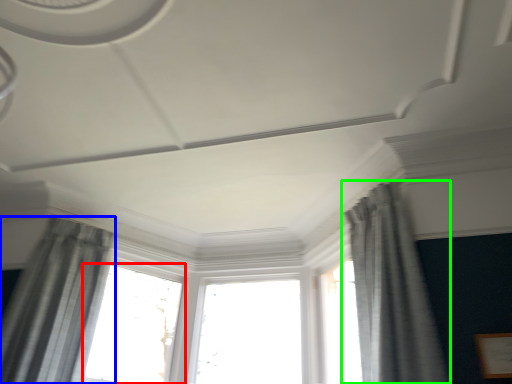
Question: Based on their relative distances, which object is nearer to window (highlighted by a red box)? Choose from curtain (highlighted by a blue box) and curtain (highlighted by a green box).

Choices:
 (A) curtain
 (B) curtain

Answer: (A)